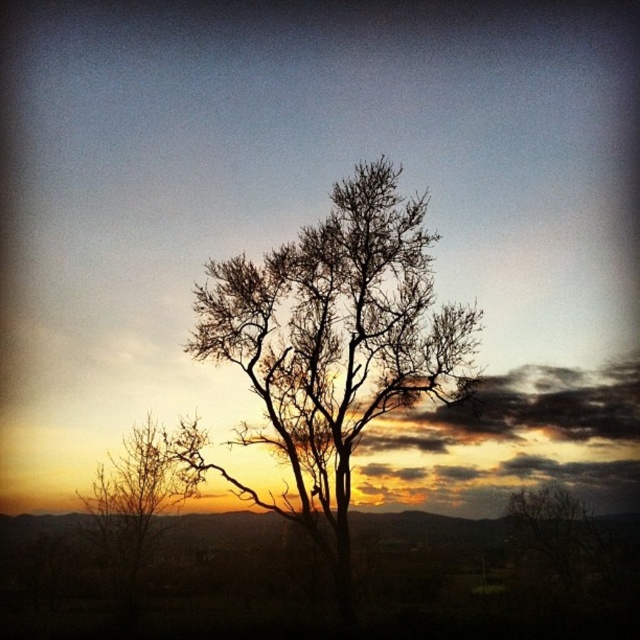
Consider the image. Which is more to the left, bare branches at center or bare branches at lower right?

bare branches at center is more to the left.

Is bare branches at center positioned behind bare branches at lower right?

No, bare branches at center is closer to the viewer.

What do you see at coordinates (333, 342) in the screenshot? Image resolution: width=640 pixels, height=640 pixels. I see `bare branches at center` at bounding box center [333, 342].

Image resolution: width=640 pixels, height=640 pixels. Identify the location of bare branches at center. (333, 342).

How much distance is there between bare branches at center and bare branches at left?

bare branches at center and bare branches at left are 38.89 feet apart.

Is point (307, 436) positioned before point (115, 500)?

Yes, it is in front of point (115, 500).

What do you see at coordinates (333, 342) in the screenshot? The width and height of the screenshot is (640, 640). I see `bare branches at center` at bounding box center [333, 342].

Locate an element on the screen. This screenshot has height=640, width=640. bare branches at center is located at coordinates (333, 342).

Measure the distance between bare branches at left and camera.

A distance of 131.68 feet exists between bare branches at left and camera.

Does bare branches at left have a larger size compared to bare branches at lower right?

Actually, bare branches at left might be smaller than bare branches at lower right.

Does point (102, 520) come behind point (518, 518)?

Yes, it is behind point (518, 518).

Find the location of a particular element. The height and width of the screenshot is (640, 640). bare branches at left is located at coordinates (134, 500).